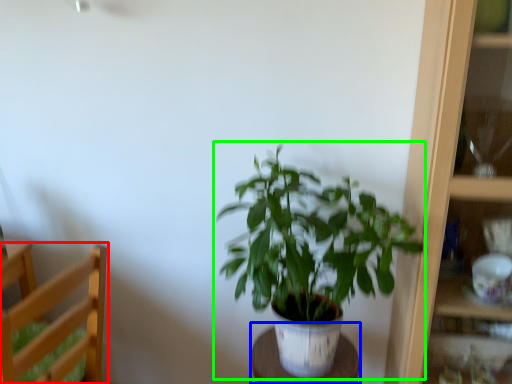
Question: Which is farther away from furniture (highlighted by a red box)? table (highlighted by a blue box) or houseplant (highlighted by a green box)?

Choices:
 (A) table
 (B) houseplant

Answer: (A)